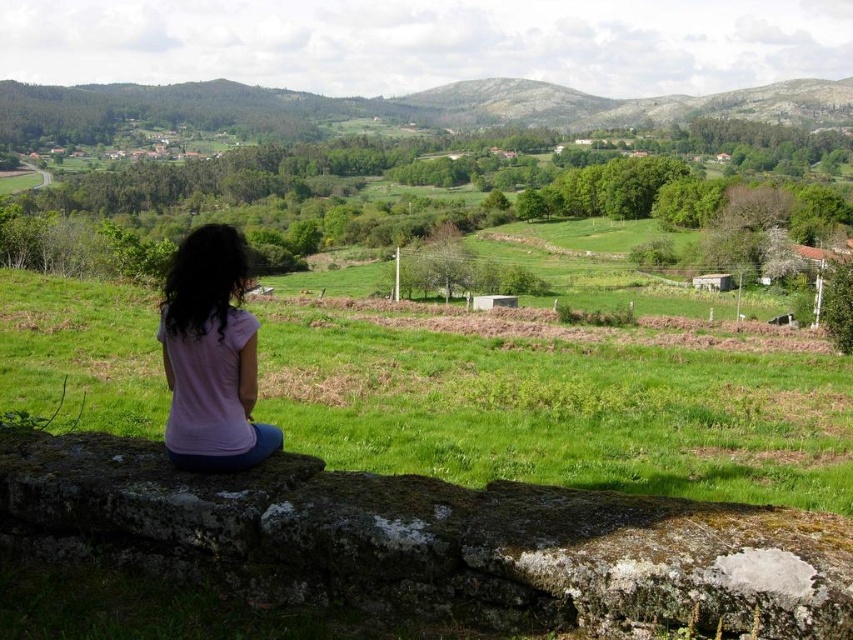
Which is more to the left, mossy stone at center or green grassy field at center?

mossy stone at center is more to the left.

Between point (515, 509) and point (451, 419), which one is positioned in front?

Point (515, 509) is in front.

In order to click on mossy stone at center in this screenshot , I will do `click(433, 541)`.

Is the position of green grassy field at center more distant than that of pink fabric shirt at lower left?

Yes.

Who is more forward, (x=723, y=493) or (x=228, y=413)?

Point (x=228, y=413) is more forward.

Find the location of a particular element. green grassy field at center is located at coordinates (560, 412).

Does point (450, 525) lie in front of point (167, 276)?

Yes, point (450, 525) is in front of point (167, 276).

Who is shorter, mossy stone at center or pink fabric shirt at lower left?

mossy stone at center

Between point (115, 476) and point (175, 308), which one is positioned behind?

Positioned behind is point (175, 308).

Locate an element on the screen. mossy stone at center is located at coordinates (433, 541).